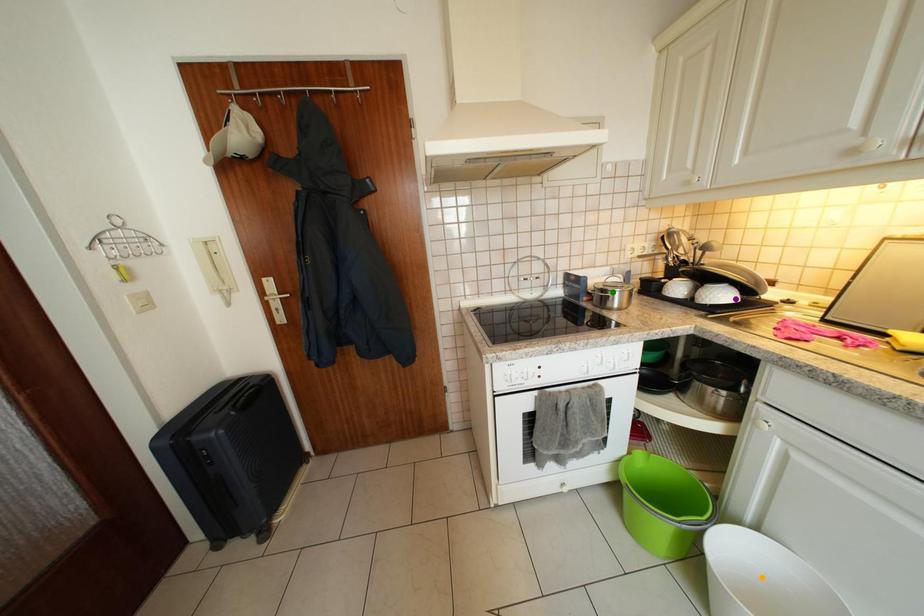
Order these from nearest to farthest:
- green point
- purple point
- orange point

orange point < purple point < green point